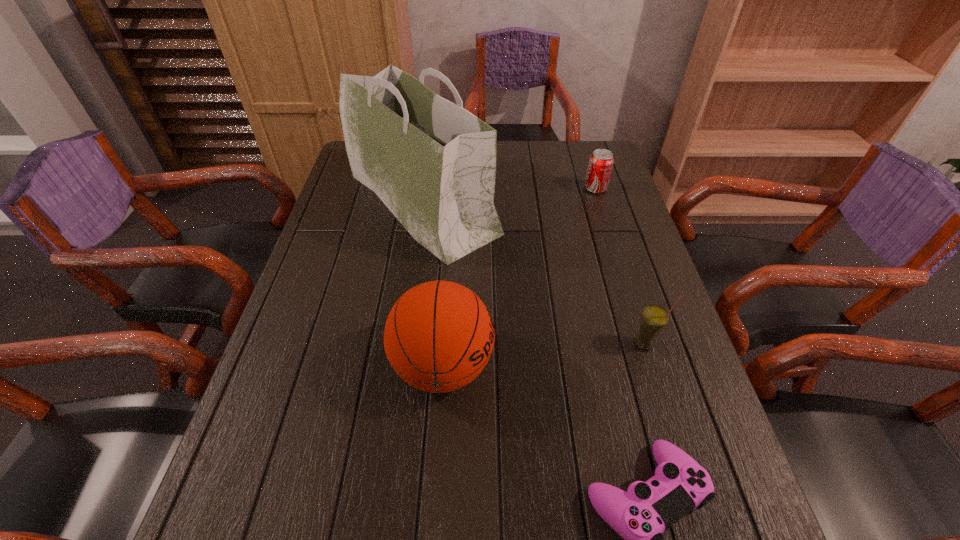
Identify the location of straw for drinking present at the right edge. (654, 318).

The height and width of the screenshot is (540, 960). I want to click on soda present at the right edge, so click(x=600, y=165).

In order to click on object at the far left corner in this screenshot , I will do `click(433, 163)`.

Image resolution: width=960 pixels, height=540 pixels. Find the location of `vacant space at the far edge of the desktop`. vacant space at the far edge of the desktop is located at coordinates (546, 150).

In the image, there is a desktop. Identify the location of blank space at the left edge. This screenshot has height=540, width=960. (347, 285).

This screenshot has width=960, height=540. What are the coordinates of `vacant area at the right edge` in the screenshot? It's located at (614, 190).

Identify the location of free spot between the basketball and the fourth tallest object. The image size is (960, 540). (519, 278).

At what (x,y) coordinates should I click in order to perform the action: click on empty space between the second shortest object and the basketball. Please return your answer as a coordinate pair (x, y). This screenshot has width=960, height=540. Looking at the image, I should click on (519, 278).

Where is `free space between the third shortest object and the fourth tallest object`? The image size is (960, 540). free space between the third shortest object and the fourth tallest object is located at coordinates (619, 266).

Identify the location of vacant area that lies between the third tallest object and the second shortest object. (619, 266).